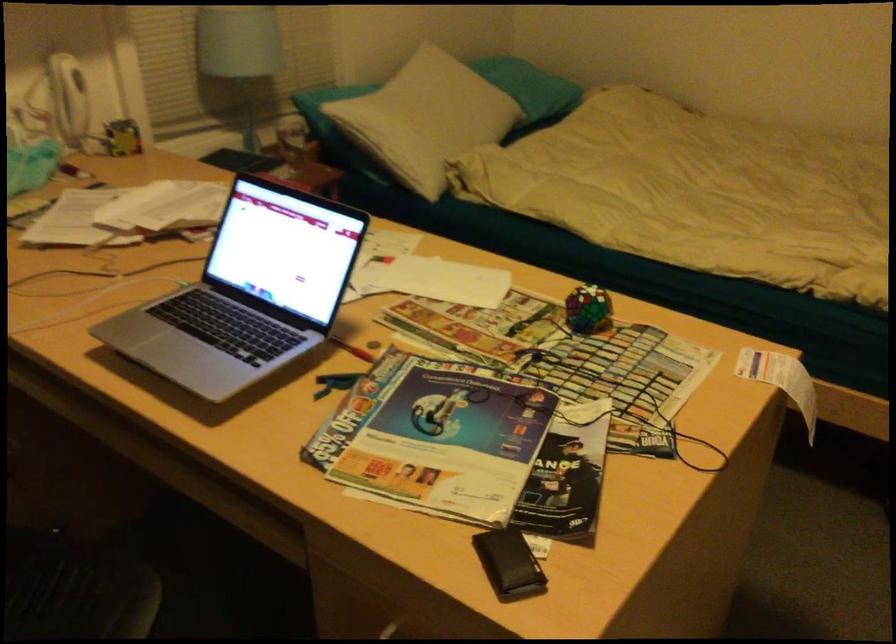
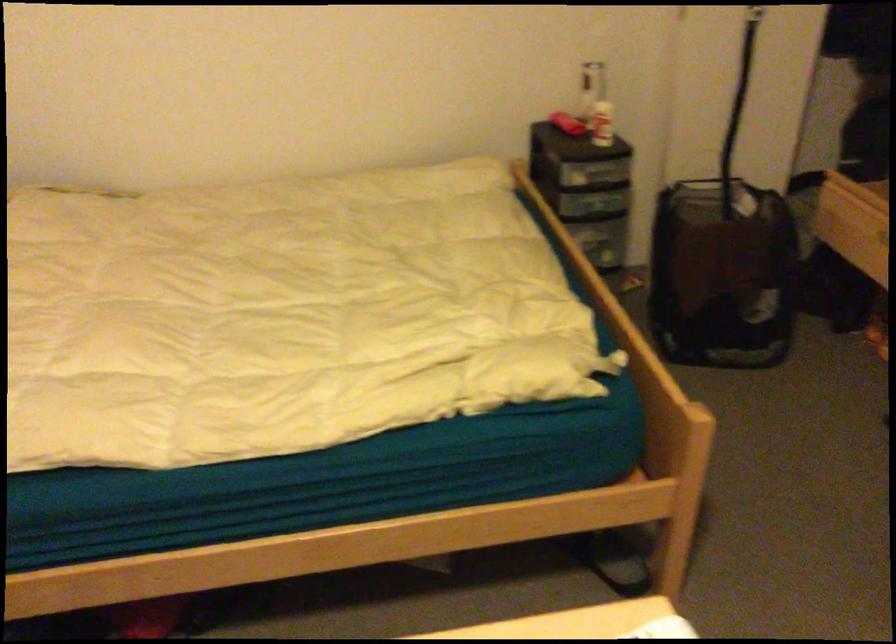
Question: Based on the continuous images, in which direction is the camera rotating? Reply with the corresponding letter.

Choices:
 (A) Left
 (B) Right
 (C) Up
 (D) Down

Answer: (B)